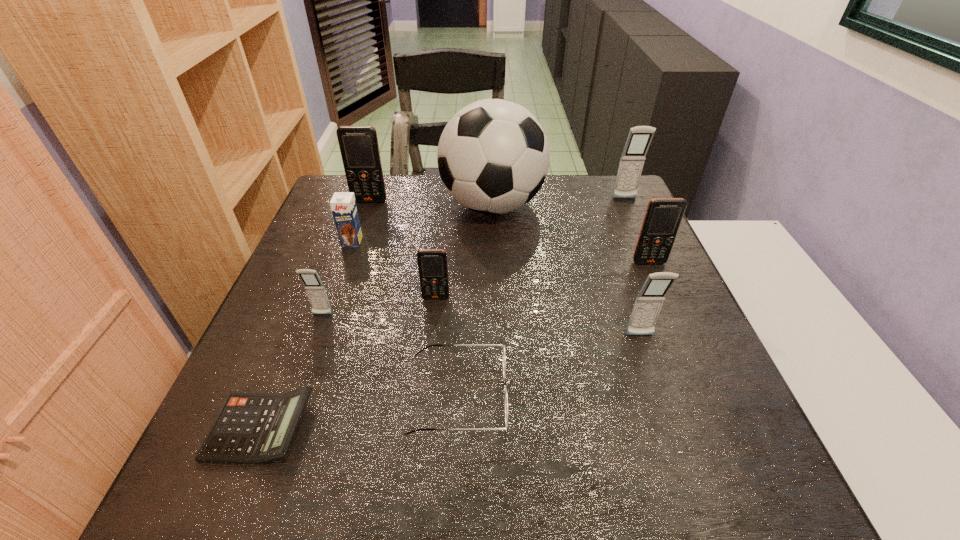
Identify the location of vacant area that lies between the seventh farthest object and the calculator. (292, 372).

This screenshot has height=540, width=960. I want to click on free space between the black soccer ball and the farthest gray cellular telephone, so click(559, 202).

Where is `free space between the second nearest orange cellular telephone and the second shortest object`? free space between the second nearest orange cellular telephone and the second shortest object is located at coordinates (554, 328).

The image size is (960, 540). In order to click on blank region between the chocolate milk and the rightmost gray cellular telephone in this screenshot , I will do `click(489, 220)`.

Identify the location of free space between the tallest object and the second shortest object. Image resolution: width=960 pixels, height=540 pixels. (475, 300).

Identify which object is the eighth closest to the black spectacles. Please provide its 2D coordinates. Your answer should be formatted as a tuple, i.e. [(x, y)], where the tuple contains the x and y coordinates of a point satisfying the conditions above.

[(359, 148)]

Identify which object is located as the ninth nearest to the biggest orange cellular telephone. Please provide its 2D coordinates. Your answer should be formatted as a tuple, i.e. [(x, y)], where the tuple contains the x and y coordinates of a point satisfying the conditions above.

[(648, 303)]

Select which cellular telephone is the fifth closest to the chocolate milk. Please provide its 2D coordinates. Your answer should be formatted as a tuple, i.e. [(x, y)], where the tuple contains the x and y coordinates of a point satisfying the conditions above.

[(663, 216)]

Find the location of a particular element. This screenshot has width=960, height=540. cellular telephone that is the fourth nearest to the shortest object is located at coordinates [x=359, y=148].

Identify which gray cellular telephone is the closest to the second nearest cellular telephone. Please provide its 2D coordinates. Your answer should be formatted as a tuple, i.e. [(x, y)], where the tuple contains the x and y coordinates of a point satisfying the conditions above.

[(648, 303)]